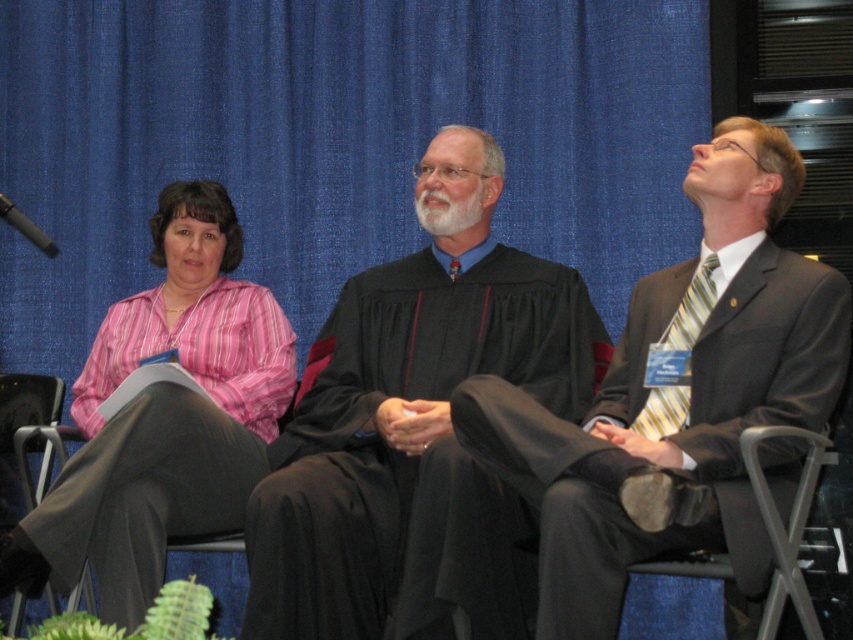
Question: Can you confirm if matte black robe at center is positioned above black plastic microphone at upper left?

Choices:
 (A) no
 (B) yes

Answer: (A)

Question: Estimate the real-world distances between objects in this image. Which object is closer to the leather seat at lower right?

Choices:
 (A) black matte robe at center
 (B) pink striped shirt at center
 (C) matte black robe at center

Answer: (C)

Question: Among these objects, which one is nearest to the camera?

Choices:
 (A) black plastic microphone at upper left
 (B) matte black robe at center
 (C) black matte robe at center
 (D) leather seat at lower right

Answer: (B)

Question: Does leather seat at lower right appear over black plastic microphone at upper left?

Choices:
 (A) no
 (B) yes

Answer: (A)

Question: Which of the following is the farthest from the observer?

Choices:
 (A) (814, 460)
 (B) (38, 248)

Answer: (B)

Question: Does black matte robe at center appear on the left side of pink striped shirt at center?

Choices:
 (A) no
 (B) yes

Answer: (A)